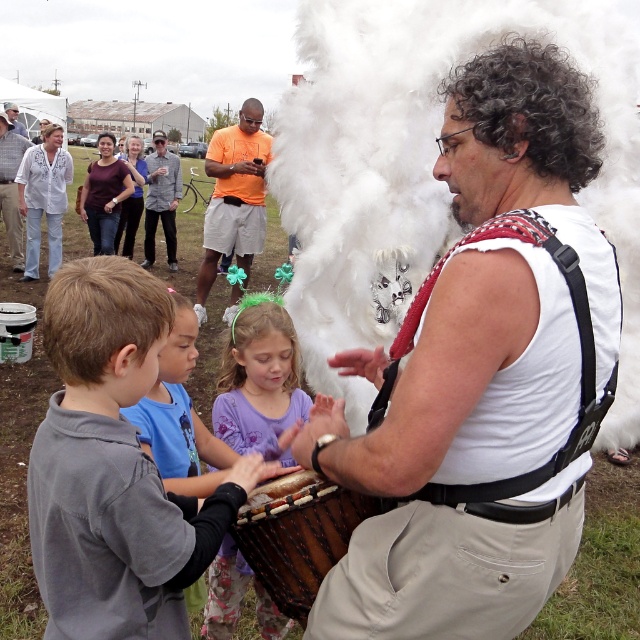
Is orange cotton shirt at center further to the viewer compared to light gray shirt at upper left?

No.

Based on the photo, can you confirm if orange cotton shirt at center is thinner than light gray shirt at upper left?

Yes.

Is point (216, 246) closer to camera compared to point (6, 195)?

Yes, point (216, 246) is closer to viewer.

Image resolution: width=640 pixels, height=640 pixels. In order to click on orange cotton shirt at center in this screenshot , I will do `click(234, 196)`.

Does gray matte shirt at center have a smaller size compared to orange cotton shirt at center?

Yes.

Does gray matte shirt at center have a lesser width compared to orange cotton shirt at center?

Yes.

Who is more distant from viewer, (97, 625) or (211, 268)?

Positioned behind is point (211, 268).

Identify the location of gray matte shirt at center. This screenshot has height=640, width=640. (113, 467).

Between white fluffy costume at center and light gray shirt at upper left, which one appears on the left side from the viewer's perspective?

From the viewer's perspective, light gray shirt at upper left appears more on the left side.

Can you confirm if white fluffy costume at center is positioned to the right of light gray shirt at upper left?

Correct, you'll find white fluffy costume at center to the right of light gray shirt at upper left.

Between point (563, 362) and point (1, 176), which one is positioned in front?

Point (563, 362) is more forward.

You are a GUI agent. You are given a task and a screenshot of the screen. Output one action in this format:
    pyautogui.click(x=<x>, y=<y>)
    Task: Click on the white fluffy costume at center
    The image size is (640, 640).
    Given the screenshot: What is the action you would take?
    [x=484, y=374]